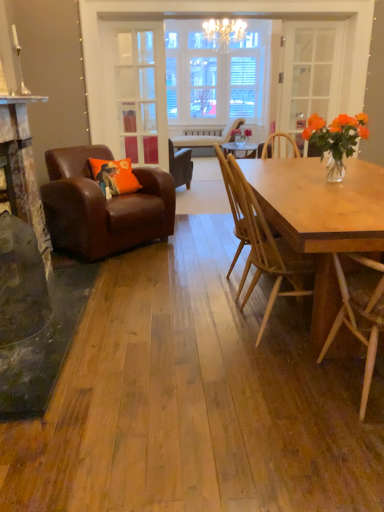
Question: Is there a large distance between orange fabric pillow at left and metallic silver fireplace at left?

Choices:
 (A) no
 (B) yes

Answer: (A)

Question: Are orange fabric pillow at left and metallic silver fireplace at left making contact?

Choices:
 (A) no
 (B) yes

Answer: (A)

Question: Is orange fabric pillow at left looking in the opposite direction of metallic silver fireplace at left?

Choices:
 (A) no
 (B) yes

Answer: (A)

Question: Can you confirm if orange fabric pillow at left is shorter than metallic silver fireplace at left?

Choices:
 (A) no
 (B) yes

Answer: (A)

Question: Could metallic silver fireplace at left be considered to be inside orange fabric pillow at left?

Choices:
 (A) yes
 (B) no

Answer: (B)

Question: In terms of height, does metallic silver fireplace at left look taller or shorter compared to clear glass door at center, arranged as the first glass door when viewed from the left?

Choices:
 (A) tall
 (B) short

Answer: (B)

Question: From the image's perspective, is metallic silver fireplace at left positioned above or below clear glass door at center, placed as the second glass door when sorted from right to left?

Choices:
 (A) above
 (B) below

Answer: (B)

Question: Is point (36, 99) positioned closer to the camera than point (135, 51)?

Choices:
 (A) closer
 (B) farther

Answer: (A)

Question: In terms of size, does metallic silver fireplace at left appear bigger or smaller than clear glass door at center, arranged as the first glass door when viewed from the left?

Choices:
 (A) small
 (B) big

Answer: (A)

Question: Is light brown wooden chair at right, which is the first chair from bottom to top, wider or thinner than brown leather armchair at left, which ranks as the 3th chair in front-to-back order?

Choices:
 (A) wide
 (B) thin

Answer: (B)

Question: Is light brown wooden chair at right, the fourth chair in the back-to-front sequence, spatially inside brown leather armchair at left, marked as the second chair in a top-to-bottom arrangement, or outside of it?

Choices:
 (A) inside
 (B) outside

Answer: (B)

Question: In the image, is light brown wooden chair at right, which is the first chair from bottom to top, on the left side or the right side of brown leather armchair at left, which ranks as the 3th chair in front-to-back order?

Choices:
 (A) left
 (B) right

Answer: (B)

Question: From a real-world perspective, is light brown wooden chair at right, which is the first chair from bottom to top, positioned above or below brown leather armchair at left, the third chair when ordered from bottom to top?

Choices:
 (A) above
 (B) below

Answer: (A)

Question: Considering their positions, is natural wood chair at right, the 3th chair in the back-to-front sequence, located in front of or behind leather armchair at center, which ranks as the first chair in top-to-bottom order?

Choices:
 (A) front
 (B) behind

Answer: (A)

Question: In terms of width, does natural wood chair at right, which is the second chair in bottom-to-top order, look wider or thinner when compared to leather armchair at center, which is counted as the first chair, starting from the back?

Choices:
 (A) thin
 (B) wide

Answer: (A)